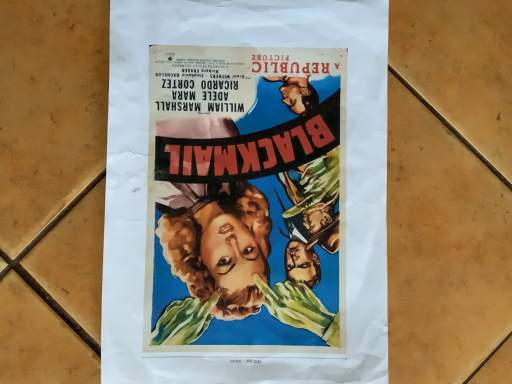
What are the coordinates of `free point above matte paper poster at center (from a real-world perspective)` in the screenshot? It's located at [251, 191].